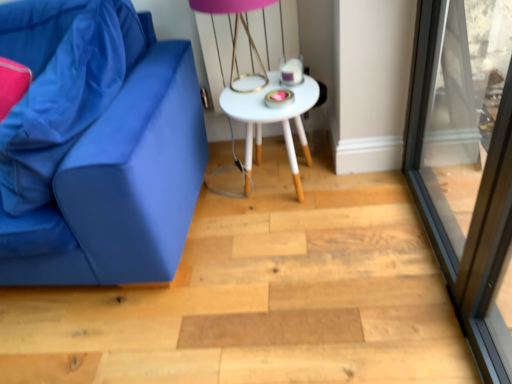
Question: Considering the positions of pink matte table lamp at upper center and white matte table at center in the image, is pink matte table lamp at upper center bigger or smaller than white matte table at center?

Choices:
 (A) small
 (B) big

Answer: (A)

Question: Considering the positions of point (248, 8) and point (251, 160), is point (248, 8) closer or farther from the camera than point (251, 160)?

Choices:
 (A) farther
 (B) closer

Answer: (B)

Question: Considering the real-world distances, which object is farthest from the transparent glass screen door at right?

Choices:
 (A) matte blue fabric pillow at left
 (B) pink matte table lamp at upper center
 (C) white matte table at center
 (D) matte blue couch at left

Answer: (A)

Question: Which of these objects is positioned farthest from the transparent glass screen door at right?

Choices:
 (A) white matte table at center
 (B) pink matte table lamp at upper center
 (C) matte blue couch at left
 (D) matte blue fabric pillow at left

Answer: (D)